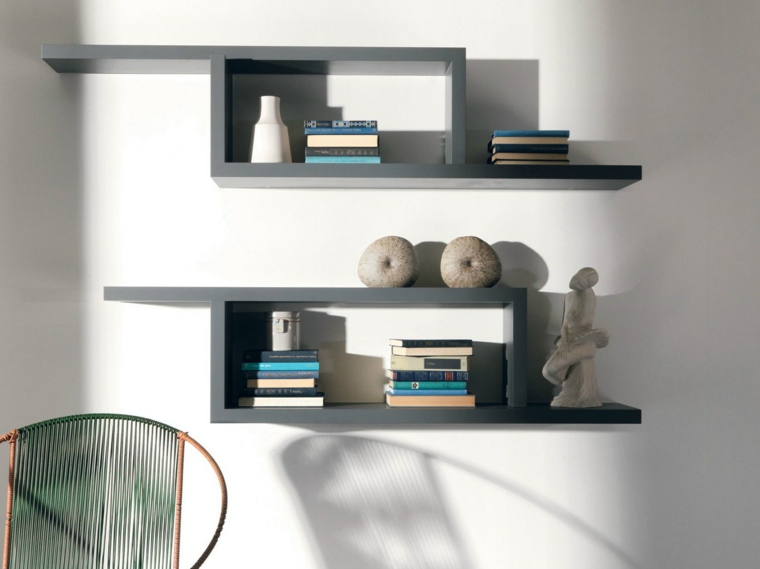
Find the location of a particular element. The height and width of the screenshot is (569, 760). bookshelf board is located at coordinates (216, 354), (309, 292), (517, 352), (382, 416), (217, 118), (340, 56), (457, 109), (388, 172).